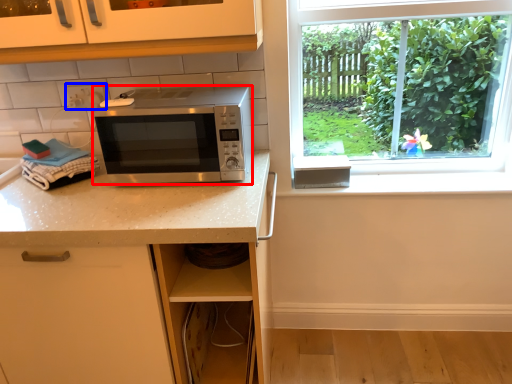
Question: Among these objects, which one is farthest to the camera, microwave oven (highlighted by a red box) or electric outlet (highlighted by a blue box)?

Choices:
 (A) microwave oven
 (B) electric outlet

Answer: (B)